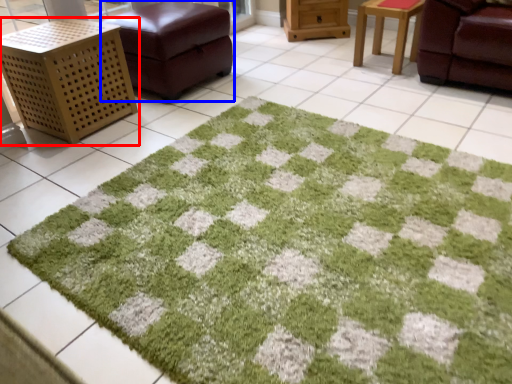
Question: Which of the following is the farthest to the observer, furniture (highlighted by a red box) or furniture (highlighted by a blue box)?

Choices:
 (A) furniture
 (B) furniture

Answer: (B)